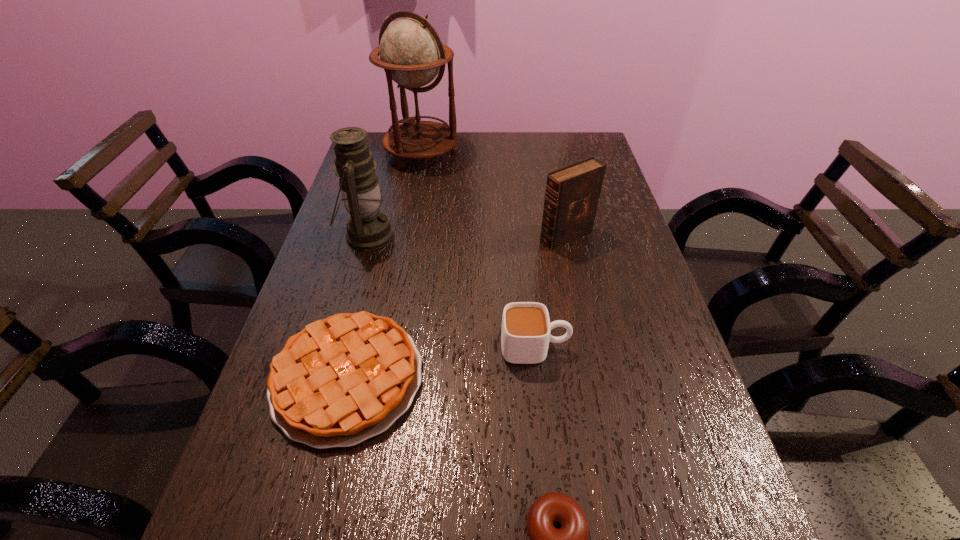
You are a GUI agent. You are given a task and a screenshot of the screen. Output one action in this format:
    pyautogui.click(x=<x>, y=<y>)
    Task: Click on the vacant point located on the back of the pie
    
    Given the screenshot: What is the action you would take?
    pyautogui.click(x=366, y=303)

At what (x,y) coordinates should I click in order to perform the action: click on object positioned at the far edge. Please return your answer as a coordinate pair (x, y). Looking at the image, I should click on (411, 53).

At what (x,y) coordinates should I click in order to perform the action: click on globe at the left edge. Please return your answer as a coordinate pair (x, y). Looking at the image, I should click on (411, 53).

This screenshot has width=960, height=540. Identify the location of oil lamp that is at the left edge. (368, 228).

You are a GUI agent. You are given a task and a screenshot of the screen. Output one action in this format:
    pyautogui.click(x=<x>, y=<y>)
    Task: Click on the pie that is at the left edge
    Image resolution: width=960 pixels, height=540 pixels.
    Given the screenshot: What is the action you would take?
    tap(342, 380)

Where is `object that is at the right edge`? object that is at the right edge is located at coordinates (572, 194).

Locate an element on the screen. This screenshot has height=540, width=960. object that is at the far left corner is located at coordinates (411, 53).

In the image, there is a desktop. In order to click on vacant space at the far edge in this screenshot , I will do `click(436, 158)`.

Image resolution: width=960 pixels, height=540 pixels. I want to click on free space at the left edge of the desktop, so click(x=335, y=263).

Identify the location of vacant region at the right edge. (663, 480).